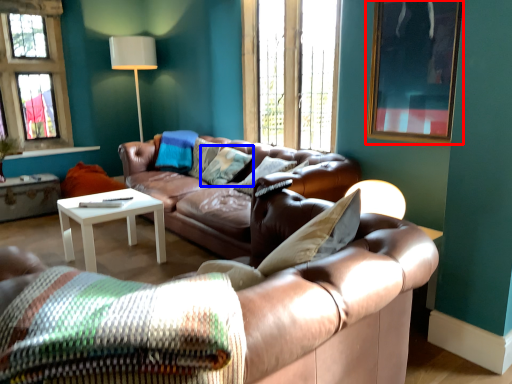
Question: Which object appears closest to the camera in this image, picture frame (highlighted by a red box) or pillow (highlighted by a blue box)?

Choices:
 (A) picture frame
 (B) pillow

Answer: (A)